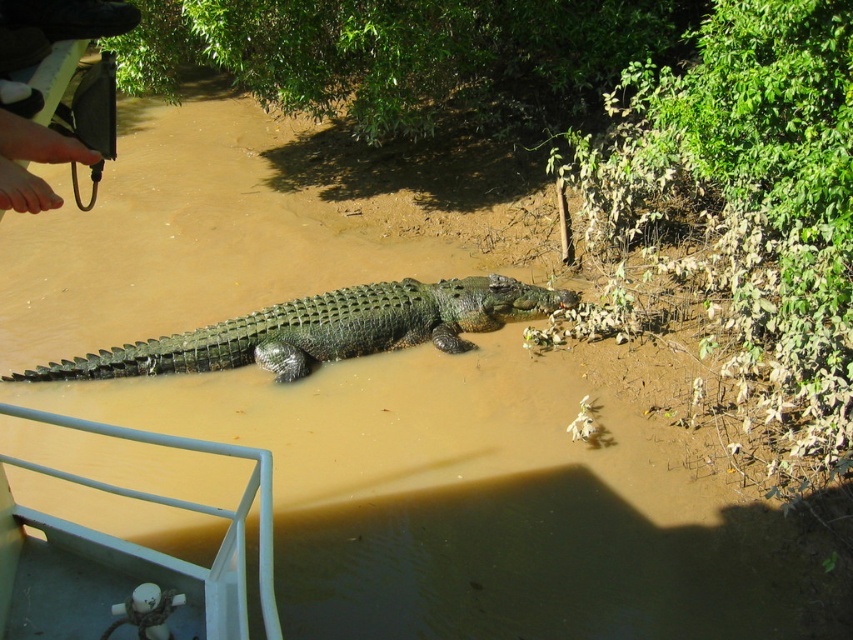
You are a park ranger observing the scene. You see the green scaly crocodile at center and the brown leather shoe at upper left. From your vantage point, which object is closer to you?

The green scaly crocodile at center is closer to you because the brown leather shoe at upper left is behind it.

You are on a boat and want to know which of the two points, point (314, 326) or point (32, 211), is closer to you. Based on the scene description, can you determine this?

Point (32, 211) is closer to you because it is less further to the camera than point (314, 326).

You are standing on the boat with white railing and rope at the edge. You see a point marked at coordinates (323, 330). What is located at that point?

At point (323, 330) lies green scaly crocodile at center.